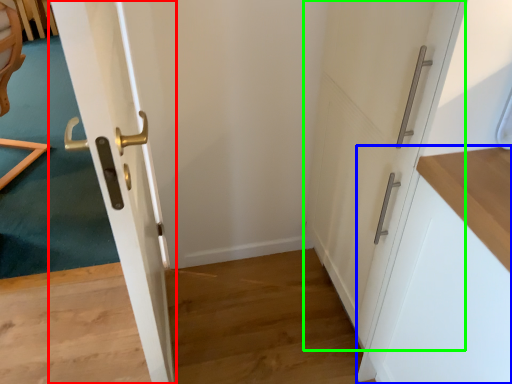
Question: Considering the real-world distances, which object is farthest from door (highlighted by a red box)? cabinetry (highlighted by a blue box) or door (highlighted by a green box)?

Choices:
 (A) cabinetry
 (B) door

Answer: (A)